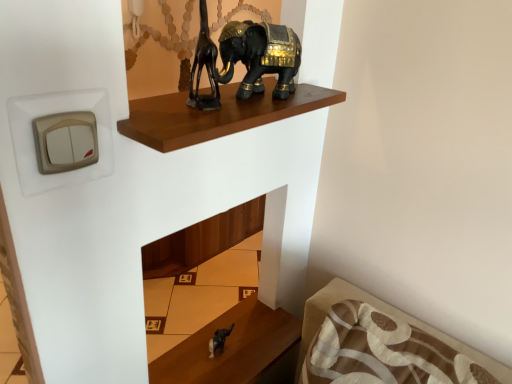
At what (x,y) coordinates should I click in order to perform the action: click on brown polished wood shelf at upper center. Please return your answer as a coordinate pair (x, y). Image resolution: width=512 pixels, height=384 pixels. Looking at the image, I should click on (216, 115).

This screenshot has width=512, height=384. Find the location of `black glossy elephant at upper center`. black glossy elephant at upper center is located at coordinates (260, 56).

In the scene shown: Measure the distance between black glossy elephant at upper center and camera.

The distance of black glossy elephant at upper center from camera is 28.74 inches.

You are a GUI agent. You are given a task and a screenshot of the screen. Output one action in this format:
    pyautogui.click(x=<x>, y=<y>)
    Task: Click on the brown polished wood shelf at upper center
    
    Given the screenshot: What is the action you would take?
    pyautogui.click(x=216, y=115)

From the image's perspective, which is above, satin black elephant at lower center or black glossy elephant at upper center?

black glossy elephant at upper center.

Is satin black elephant at lower center closer to camera compared to black glossy elephant at upper center?

That is False.

From a real-world perspective, is satin black elephant at lower center physically located above or below black glossy elephant at upper center?

From a real-world perspective, satin black elephant at lower center is physically below black glossy elephant at upper center.

Based on the photo, how much distance is there between satin black elephant at lower center and black glossy elephant at upper center?

70.53 centimeters.

From the image's perspective, is brown polished wood shelf at upper center positioned above or below black glossy elephant at upper center?

brown polished wood shelf at upper center is below black glossy elephant at upper center.

Could you tell me if brown polished wood shelf at upper center is turned towards black glossy elephant at upper center?

No.

Between point (179, 135) and point (285, 55), which one is positioned behind?

The point (285, 55) is more distant.

Considering the relative sizes of brown polished wood shelf at upper center and black glossy elephant at upper center in the image provided, is brown polished wood shelf at upper center bigger than black glossy elephant at upper center?

Actually, brown polished wood shelf at upper center might be smaller than black glossy elephant at upper center.

Is black glossy elephant at upper center positioned beyond the bounds of satin black elephant at lower center?

Yes, black glossy elephant at upper center is outside of satin black elephant at lower center.

Is black glossy elephant at upper center positioned far away from satin black elephant at lower center?

No, black glossy elephant at upper center is not far away from satin black elephant at lower center.

Considering the relative sizes of black glossy elephant at upper center and satin black elephant at lower center in the image provided, is black glossy elephant at upper center smaller than satin black elephant at lower center?

No, black glossy elephant at upper center is not smaller than satin black elephant at lower center.

In the image, there is a black glossy elephant at upper center. What are the coordinates of `furniture below it (from a real-world perspective)` in the screenshot? It's located at (236, 349).

Would you consider black glossy elephant at upper center to be distant from brown polished wood shelf at upper center?

Actually, black glossy elephant at upper center and brown polished wood shelf at upper center are a little close together.

Does black glossy elephant at upper center have a greater height compared to brown polished wood shelf at upper center?

Correct, black glossy elephant at upper center is much taller as brown polished wood shelf at upper center.

From a real-world perspective, is black glossy elephant at upper center physically above brown polished wood shelf at upper center?

Yes.

Considering the positions of point (293, 60) and point (175, 137), is point (293, 60) closer or farther from the camera than point (175, 137)?

Clearly, point (293, 60) is more distant from the camera than point (175, 137).

From a real-world perspective, which object rests below the other?

satin black elephant at lower center is physically lower.

Would you say satin black elephant at lower center is part of brown polished wood shelf at upper center's contents?

No, brown polished wood shelf at upper center does not contain satin black elephant at lower center.

Is satin black elephant at lower center at the back of brown polished wood shelf at upper center?

brown polished wood shelf at upper center is not turned away from satin black elephant at lower center.

Does point (159, 125) come behind point (239, 319)?

No, it is in front of (239, 319).

Can you confirm if satin black elephant at lower center is positioned to the left of brown polished wood shelf at upper center?

Yes, satin black elephant at lower center is to the left of brown polished wood shelf at upper center.

Considering the positions of points (149, 380) and (150, 129), is point (149, 380) closer to camera compared to point (150, 129)?

No, (149, 380) is further to viewer.

Which object is thinner, satin black elephant at lower center or brown polished wood shelf at upper center?

brown polished wood shelf at upper center.

In the image, is satin black elephant at lower center positioned in front of or behind brown polished wood shelf at upper center?

In the image, satin black elephant at lower center appears behind brown polished wood shelf at upper center.

Identify the location of furniture on the left of black glossy elephant at upper center. (236, 349).

This screenshot has width=512, height=384. Identify the location of shelf in front of the black glossy elephant at upper center. (216, 115).

From the image, which object appears to be farther from black glossy elephant at upper center, satin black elephant at lower center or brown polished wood shelf at upper center?

Among the two, satin black elephant at lower center is located further to black glossy elephant at upper center.

Based on their spatial positions, is satin black elephant at lower center or black glossy elephant at upper center closer to brown polished wood shelf at upper center?

Among the two, black glossy elephant at upper center is located nearer to brown polished wood shelf at upper center.

Estimate the real-world distances between objects in this image. Which object is further from black glossy elephant at upper center, brown polished wood shelf at upper center or satin black elephant at lower center?

Based on the image, satin black elephant at lower center appears to be further to black glossy elephant at upper center.

From the image, which object appears to be farther from satin black elephant at lower center, black glossy elephant at upper center or brown polished wood shelf at upper center?

black glossy elephant at upper center lies further to satin black elephant at lower center than the other object.

Looking at the image, which one is located closer to satin black elephant at lower center, brown polished wood shelf at upper center or black glossy elephant at upper center?

Based on the image, brown polished wood shelf at upper center appears to be nearer to satin black elephant at lower center.

Estimate the real-world distances between objects in this image. Which object is closer to brown polished wood shelf at upper center, black glossy elephant at upper center or satin black elephant at lower center?

black glossy elephant at upper center lies closer to brown polished wood shelf at upper center than the other object.

I want to click on shelf between black glossy elephant at upper center and satin black elephant at lower center vertically, so (x=216, y=115).